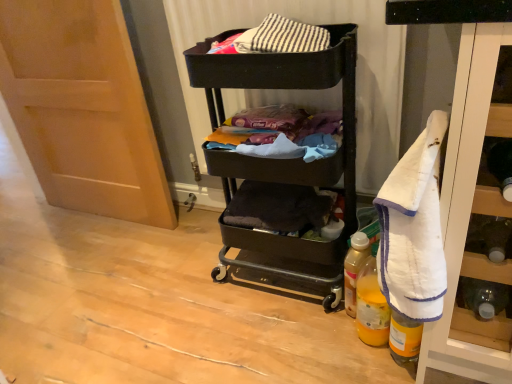
Where is `free space to the left of translucent plastic bottle at lower right, positioned as the 3th bottle in front-to-back order`? Image resolution: width=512 pixels, height=384 pixels. free space to the left of translucent plastic bottle at lower right, positioned as the 3th bottle in front-to-back order is located at coordinates point(302,315).